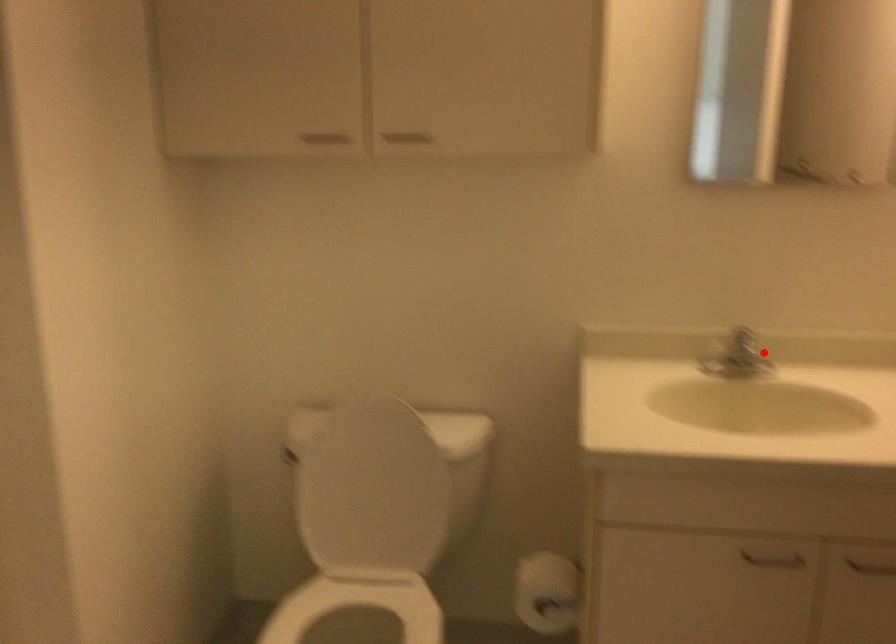
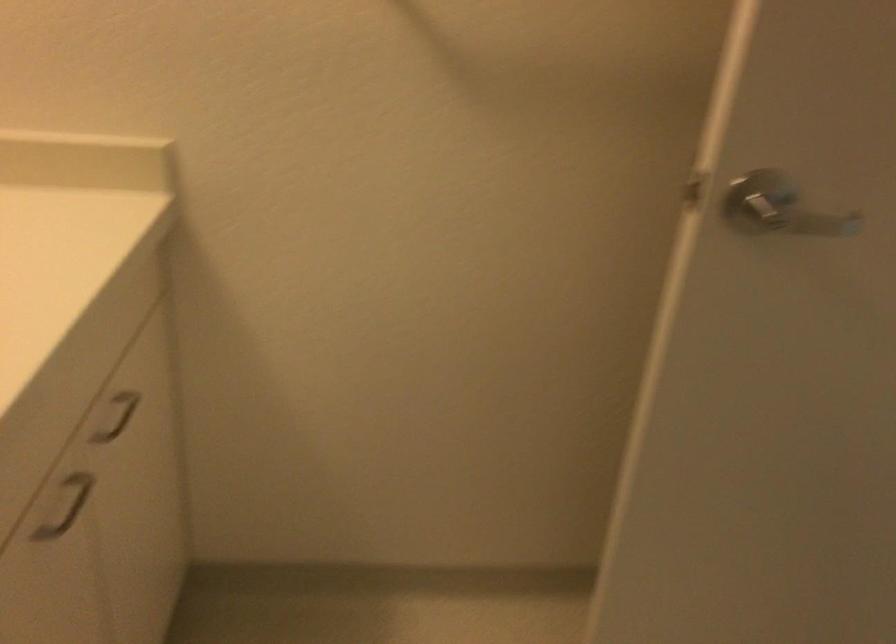
Question: I am providing you with two images of the same scene from different viewpoints. A red point is shown in image1. For the corresponding object point in image2, is it positioned nearer or farther from the camera?

Choices:
 (A) Nearer
 (B) Farther

Answer: (A)